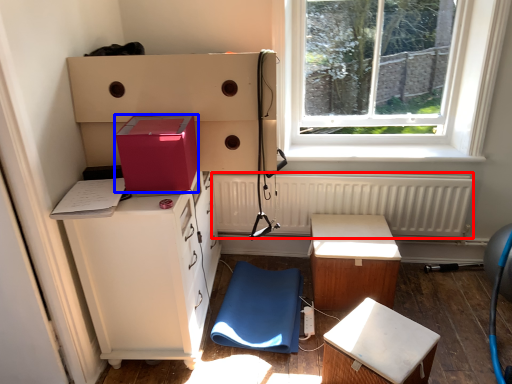
Question: Which object appears farthest to the camera in this image, radiator (highlighted by a red box) or box (highlighted by a blue box)?

Choices:
 (A) radiator
 (B) box

Answer: (A)